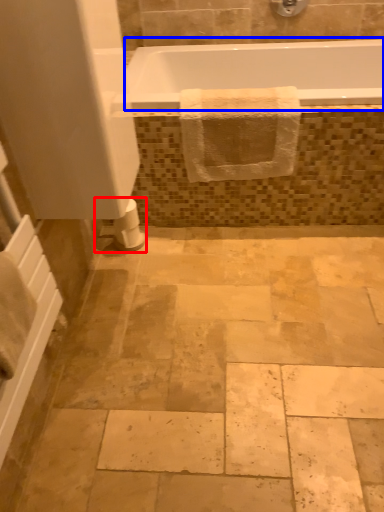
Question: Which object is further to the camera taking this photo, toilet paper (highlighted by a red box) or bathtub (highlighted by a blue box)?

Choices:
 (A) toilet paper
 (B) bathtub

Answer: (A)